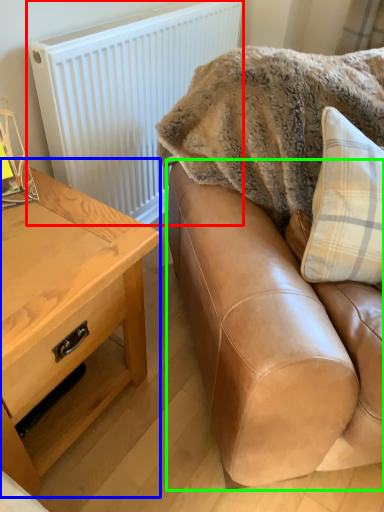
Question: Which object is positioned closest to radiator (highlighted by a red box)? Select from table (highlighted by a blue box) and studio couch (highlighted by a green box).

Choices:
 (A) table
 (B) studio couch

Answer: (A)